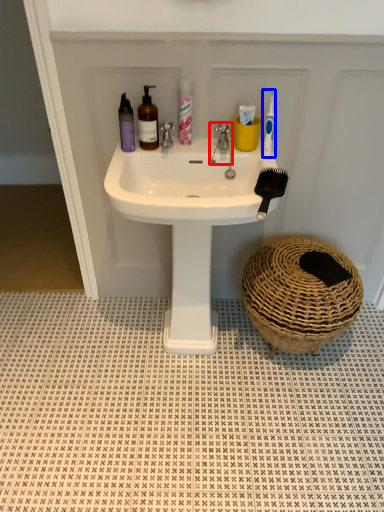
Question: Among these objects, which one is farthest to the camera, tap (highlighted by a red box) or toothbrush (highlighted by a blue box)?

Choices:
 (A) tap
 (B) toothbrush

Answer: (A)